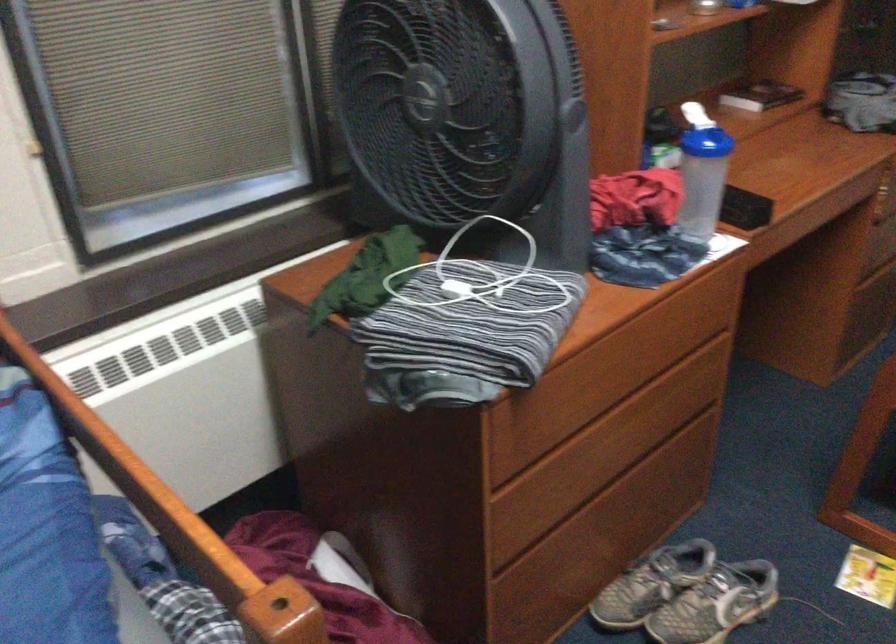
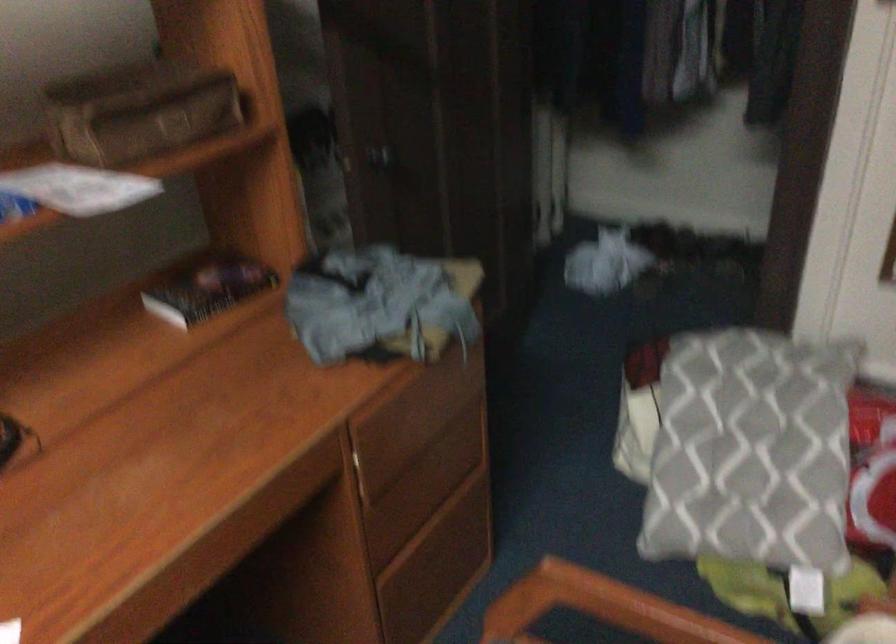
Which direction would the cameraman need to move to produce the second image?

The cameraman walked toward right, forward.